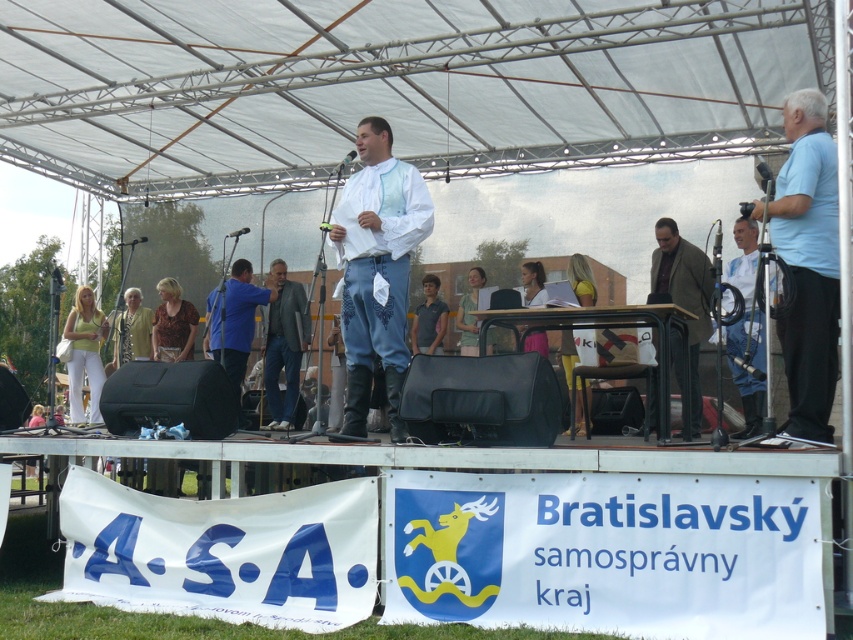
Question: Estimate the real-world distances between objects in this image. Which object is closer to the brown printed blouse at center?

Choices:
 (A) yellow fabric dress at center
 (B) white fabric shirt at right
 (C) light brown textured dress at lower left
 (D) denim jacket at center

Answer: (C)

Question: Which point is closer to the camera taking this photo?

Choices:
 (A) (370, 230)
 (B) (485, 275)
 (C) (299, 310)

Answer: (A)

Question: Is brown printed blouse at center smaller than dark blue shirt at center?

Choices:
 (A) no
 (B) yes

Answer: (A)

Question: Does denim jacket at center appear on the right side of matte yellow blouse at lower left?

Choices:
 (A) yes
 (B) no

Answer: (A)

Question: Can you confirm if light blue shirt at right is positioned above black matte microphone at center?

Choices:
 (A) no
 (B) yes

Answer: (A)

Question: Which object is positioned closest to the black matte microphone at center?

Choices:
 (A) light brown textured dress at lower left
 (B) light blue shirt at right
 (C) metallic silver microphone at center

Answer: (C)